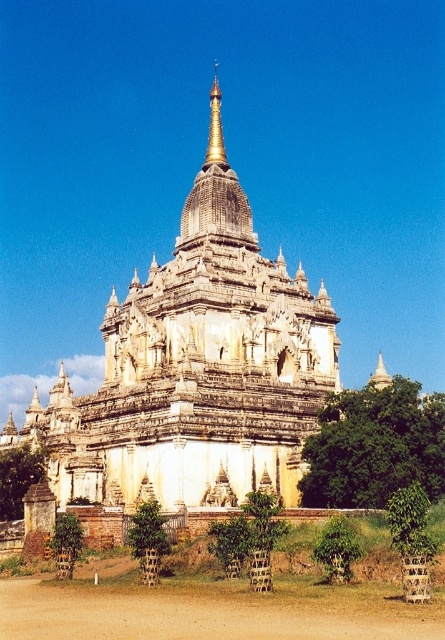
You are standing in front of the temple and notice a specific location marked at point (178,618). What is the object at this coordinate?

The object at point (178,618) is the brown sandy dirt at lower center.

You are a visitor standing in front of the temple and notice the brown sandy dirt at lower center and the gold polished spire at center. Which of these two features takes up more visual space in the image?

The gold polished spire at center occupies more visual space than the brown sandy dirt at lower center according to the description.